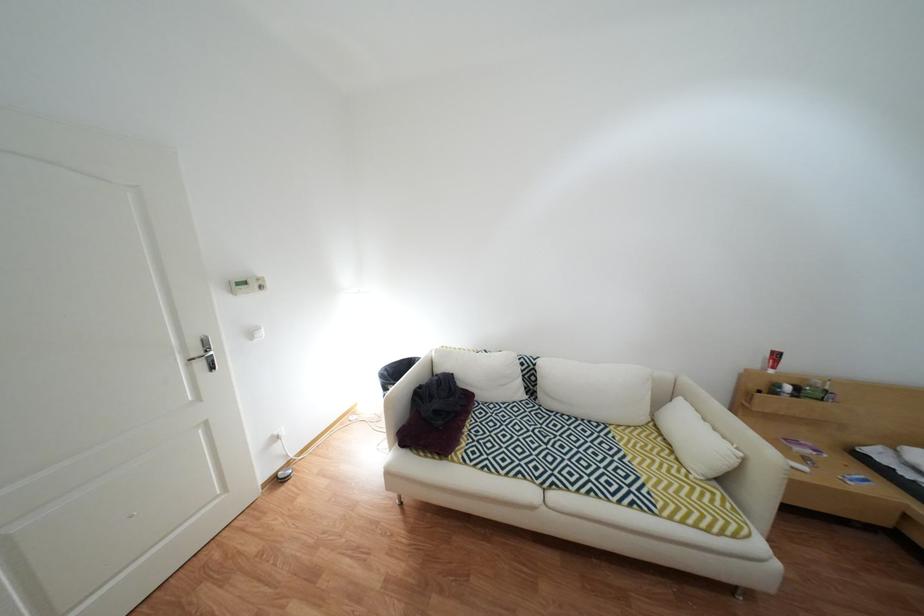
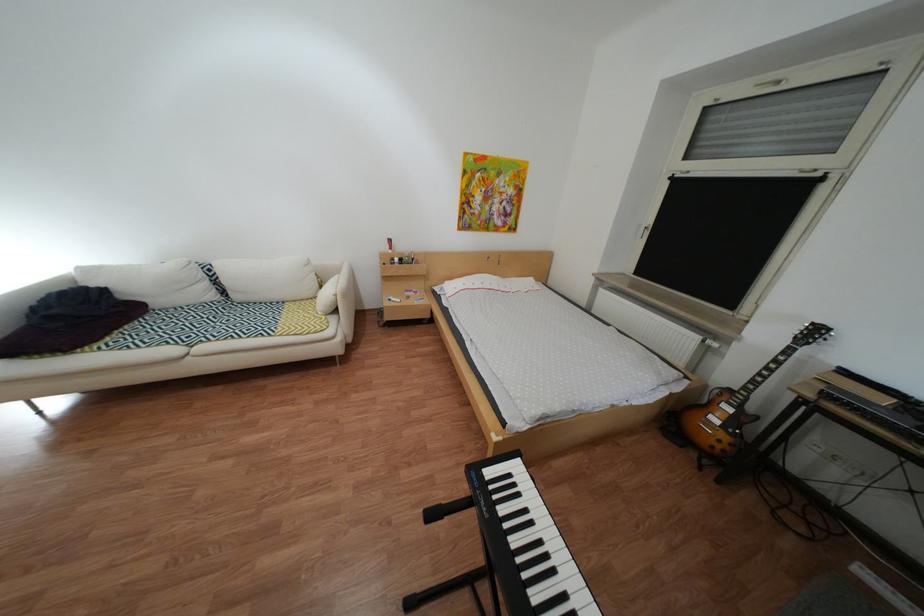
Where in the second image is the point corresponding to pixel 536 379 from the first image?

(223, 284)